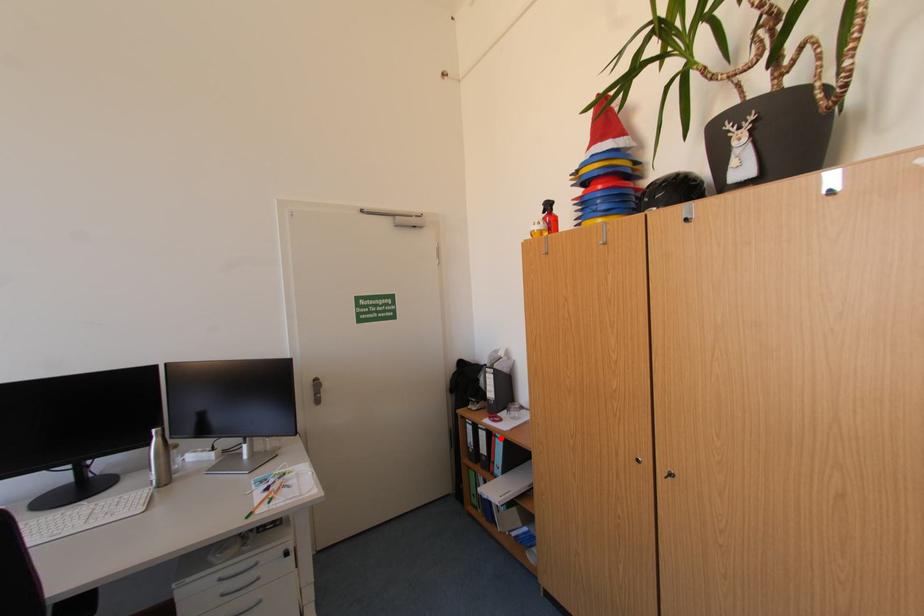
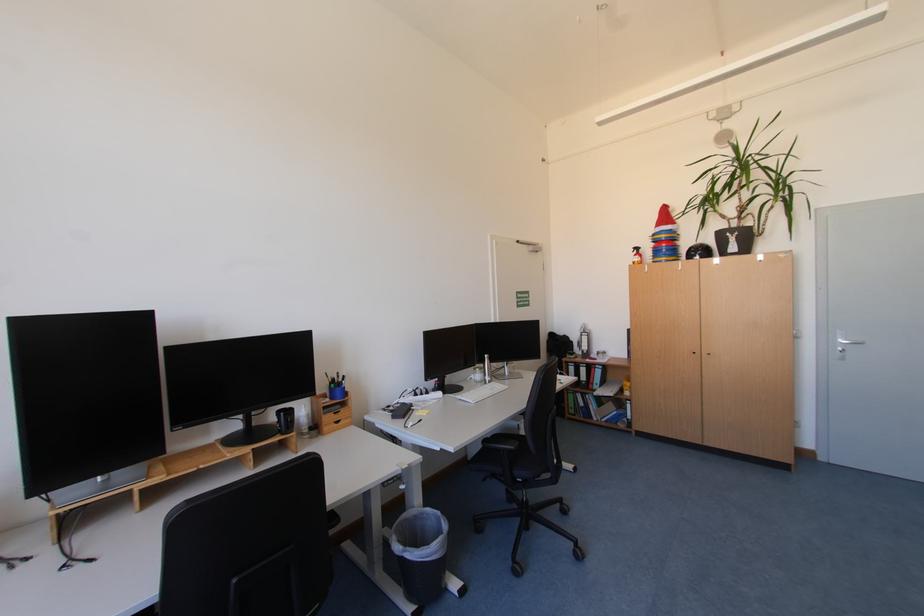
The point at the highlighted location is marked in the first image. Where is the corresponding point in the second image?

(601, 370)